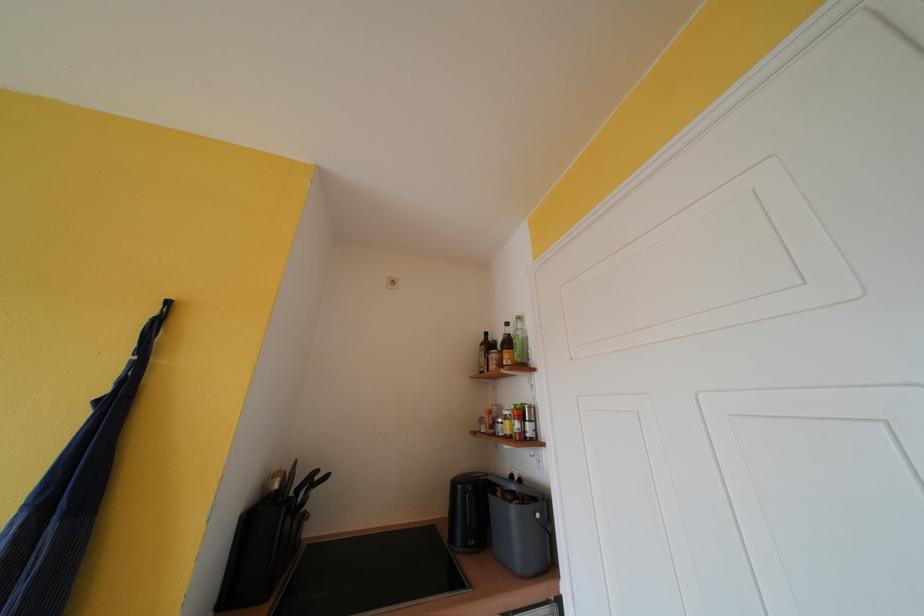
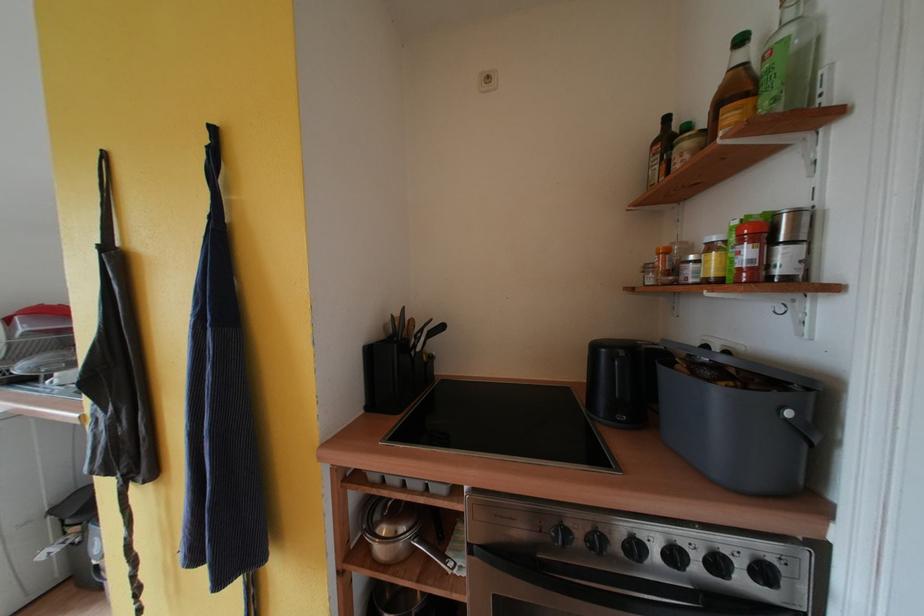
First-person continuous shooting, in which direction is the camera rotating?

The rotation direction of the camera is left-down.